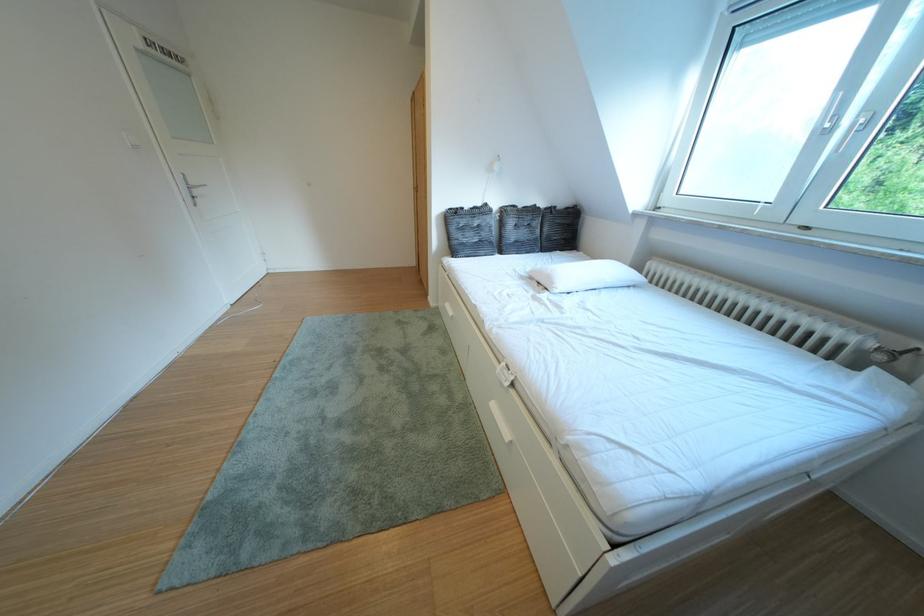
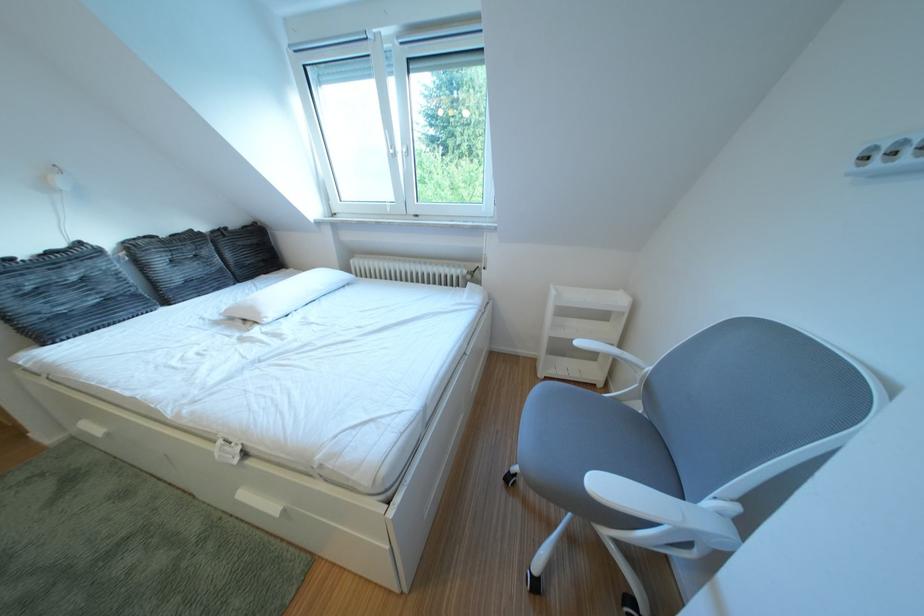
Find the pixel in the second image that matches pixel 576 208 in the first image.

(247, 228)